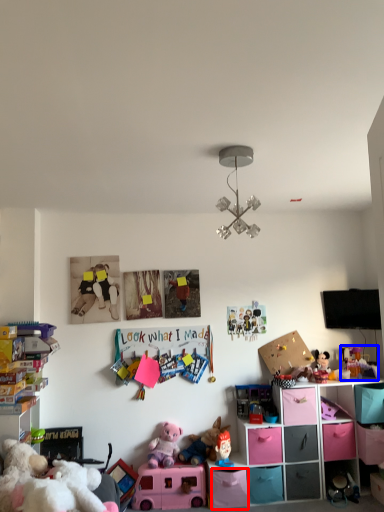
Question: Which object appears closest to the camera in this image, drawer (highlighted by a red box) or toy (highlighted by a blue box)?

Choices:
 (A) drawer
 (B) toy

Answer: (A)